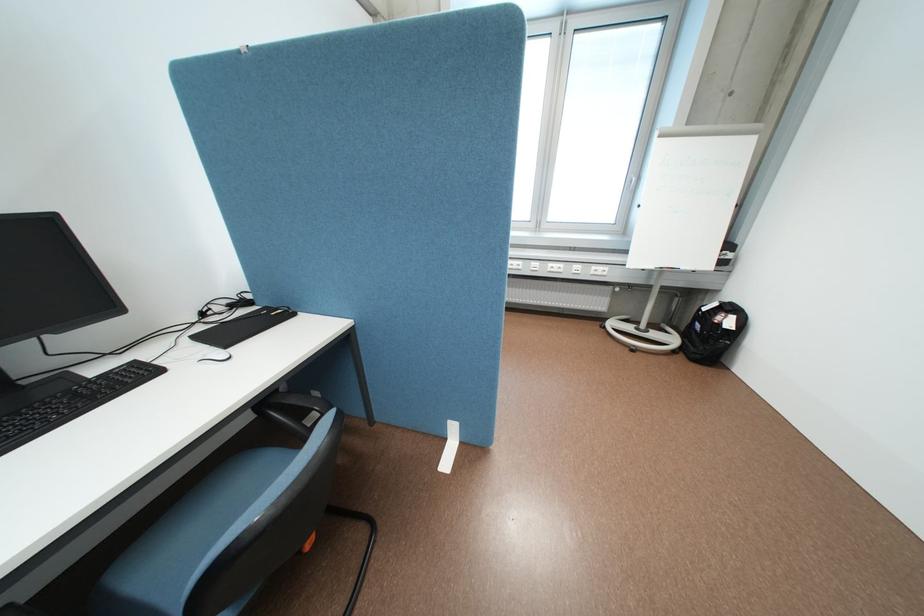
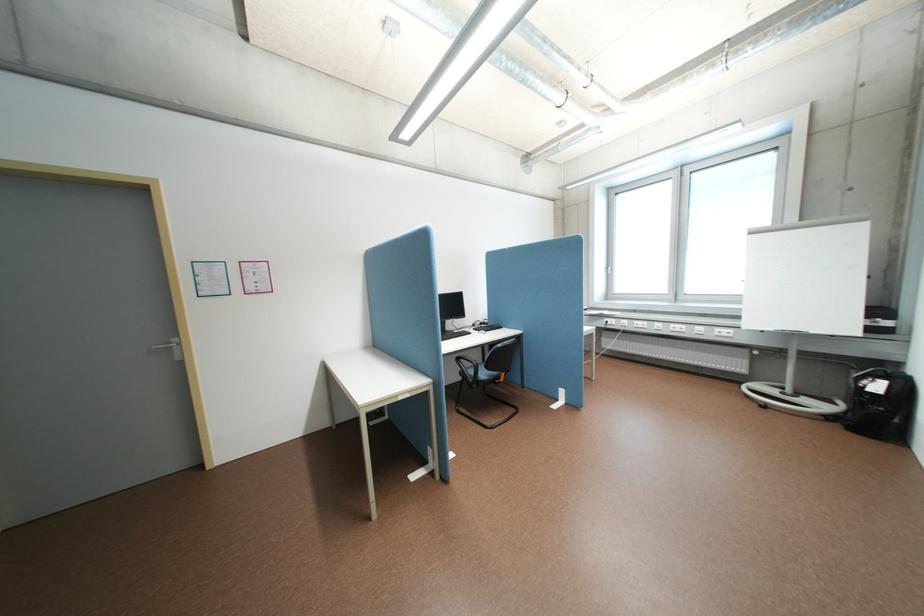
Find the pixel in the second image that matches pixel 691 357 in the first image.

(848, 424)